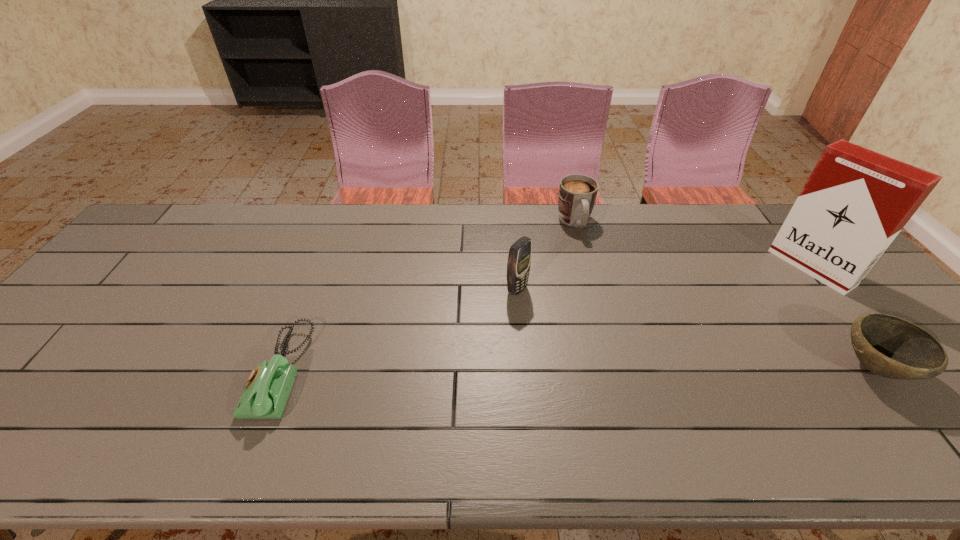
Where is `vacant space located on the dial of the shortest object`? vacant space located on the dial of the shortest object is located at coordinates (203, 372).

The height and width of the screenshot is (540, 960). Identify the location of free spot located on the back of the fourth tallest object. (822, 300).

Find the location of a particular element. free space located 0.300m on the side of the mug with the handle is located at coordinates (608, 306).

This screenshot has height=540, width=960. What are the coordinates of `vacant point located on the side of the mug with the handle` in the screenshot? It's located at (585, 248).

Where is `free space located on the side of the mug with the handle`? free space located on the side of the mug with the handle is located at coordinates (591, 265).

Where is `vacant area located on the front face of the cellular telephone`? This screenshot has width=960, height=540. vacant area located on the front face of the cellular telephone is located at coordinates (614, 345).

This screenshot has height=540, width=960. In order to click on free space located on the front face of the cellular telephone in this screenshot , I will do `click(614, 345)`.

At what (x,y) coordinates should I click in order to perform the action: click on vacant space located on the front face of the cellular telephone. Please return your answer as a coordinate pair (x, y). Looking at the image, I should click on (587, 329).

Where is `free space located on the front-facing side of the tallest object`? free space located on the front-facing side of the tallest object is located at coordinates (771, 297).

Find the location of a particular element. This screenshot has height=540, width=960. free space located 0.400m on the front-facing side of the tallest object is located at coordinates (705, 339).